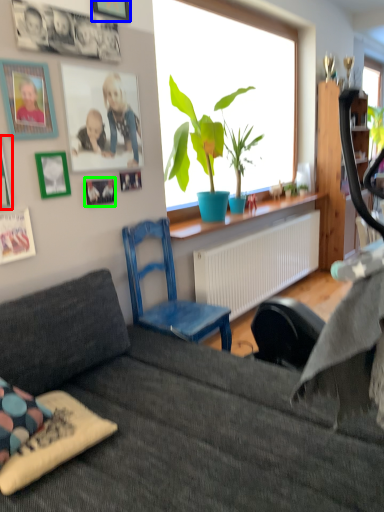
Question: Which is nearer to the picture frame (highlighted by a red box)? picture frame (highlighted by a blue box) or picture frame (highlighted by a green box).

Choices:
 (A) picture frame
 (B) picture frame

Answer: (B)